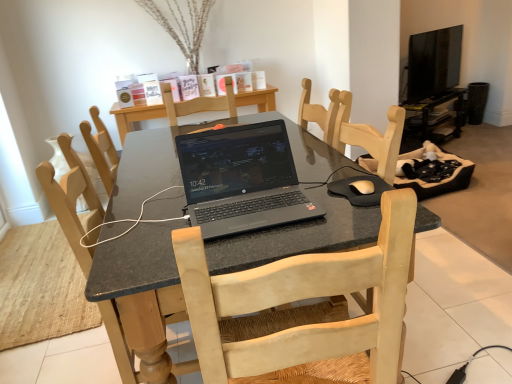
Question: From the image's perspective, is light wood chair at center under black rubber mousepad at center?

Choices:
 (A) no
 (B) yes

Answer: (B)

Question: Does light wood chair at center come behind black rubber mousepad at center?

Choices:
 (A) yes
 (B) no

Answer: (B)

Question: Is the depth of light wood chair at center less than that of black rubber mousepad at center?

Choices:
 (A) yes
 (B) no

Answer: (A)

Question: Is light wood chair at center aimed at black rubber mousepad at center?

Choices:
 (A) yes
 (B) no

Answer: (A)

Question: Can you confirm if light wood chair at center is positioned to the right of black rubber mousepad at center?

Choices:
 (A) yes
 (B) no

Answer: (B)

Question: Does light wood chair at center have a lesser width compared to black rubber mousepad at center?

Choices:
 (A) no
 (B) yes

Answer: (A)

Question: Considering the relative sizes of black glossy computer desk at upper right and black matte laptop at center in the image provided, is black glossy computer desk at upper right wider than black matte laptop at center?

Choices:
 (A) yes
 (B) no

Answer: (B)

Question: From a real-world perspective, is black glossy computer desk at upper right on top of black matte laptop at center?

Choices:
 (A) yes
 (B) no

Answer: (B)

Question: Is black glossy computer desk at upper right positioned in front of black matte laptop at center?

Choices:
 (A) no
 (B) yes

Answer: (A)

Question: Is black glossy computer desk at upper right shorter than black matte laptop at center?

Choices:
 (A) yes
 (B) no

Answer: (B)

Question: Is black glossy computer desk at upper right positioned beyond the bounds of black matte laptop at center?

Choices:
 (A) yes
 (B) no

Answer: (A)

Question: From a real-world perspective, is black glossy computer desk at upper right located beneath black matte laptop at center?

Choices:
 (A) no
 (B) yes

Answer: (B)

Question: From the image's perspective, is black rubber mousepad at center located beneath black glossy tv at upper right?

Choices:
 (A) no
 (B) yes

Answer: (B)